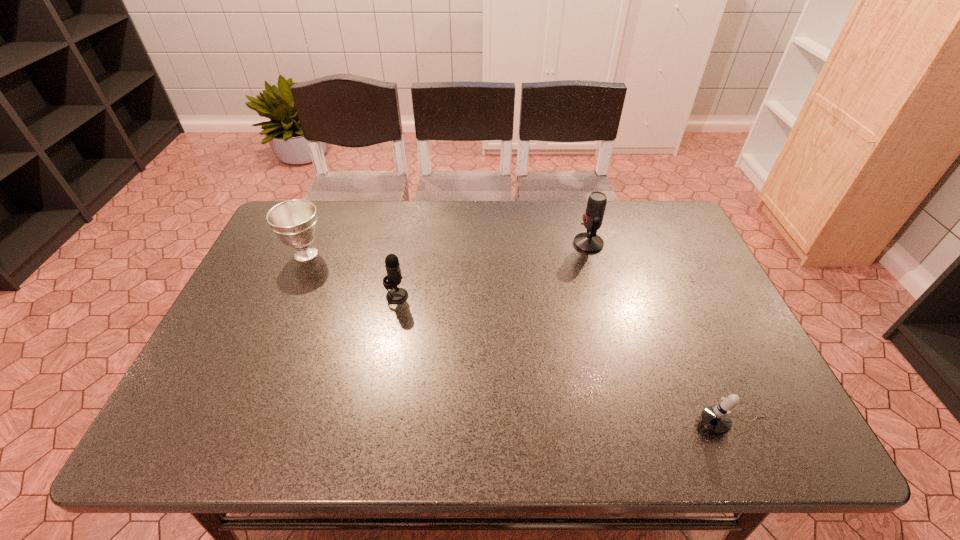
You are a GUI agent. You are given a task and a screenshot of the screen. Output one action in this format:
    pyautogui.click(x=<x>, y=<y>)
    Task: Click on the free space at the far edge of the desktop
    Image resolution: width=960 pixels, height=540 pixels.
    Given the screenshot: What is the action you would take?
    pyautogui.click(x=459, y=241)

Locate an element on the screen. The height and width of the screenshot is (540, 960). blank space at the near edge of the desktop is located at coordinates (510, 428).

In the image, there is a desktop. Where is `vacant space at the left edge`? The image size is (960, 540). vacant space at the left edge is located at coordinates (199, 368).

Image resolution: width=960 pixels, height=540 pixels. What are the coordinates of `free space at the right edge` in the screenshot? It's located at (753, 354).

Locate an element on the screen. The height and width of the screenshot is (540, 960). vacant space at the near left corner of the desktop is located at coordinates coord(236,432).

Find the location of a particular element. This screenshot has width=960, height=540. free space at the far right corner is located at coordinates (665, 226).

Where is `unoccupied position between the chalice and the second tallest microphone`? unoccupied position between the chalice and the second tallest microphone is located at coordinates (351, 275).

This screenshot has height=540, width=960. What are the coordinates of `vacant space that is in between the second object from right to left and the second tallest microphone` in the screenshot? It's located at (492, 270).

Locate an element on the screen. The height and width of the screenshot is (540, 960). free space between the farthest microphone and the leftmost object is located at coordinates (447, 249).

In order to click on vacant area that lies between the chalice and the rightmost microphone in this screenshot , I will do `click(519, 340)`.